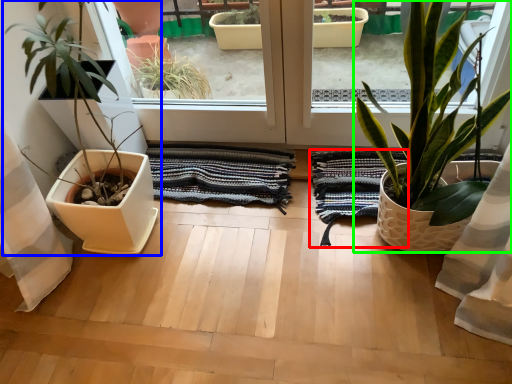
Question: Which is nearer to the bath towel (highlighted by a red box)? houseplant (highlighted by a blue box) or houseplant (highlighted by a green box).

Choices:
 (A) houseplant
 (B) houseplant

Answer: (B)